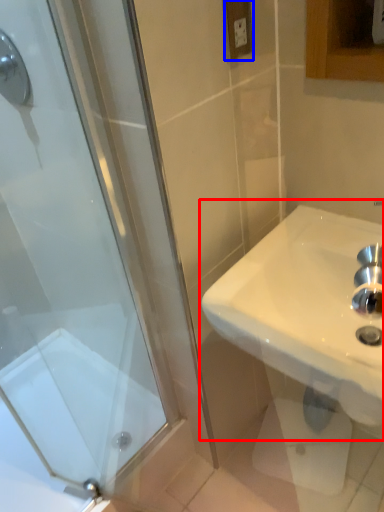
Question: Which point is further to the camera, sink (highlighted by a red box) or electric outlet (highlighted by a blue box)?

Choices:
 (A) sink
 (B) electric outlet

Answer: (B)